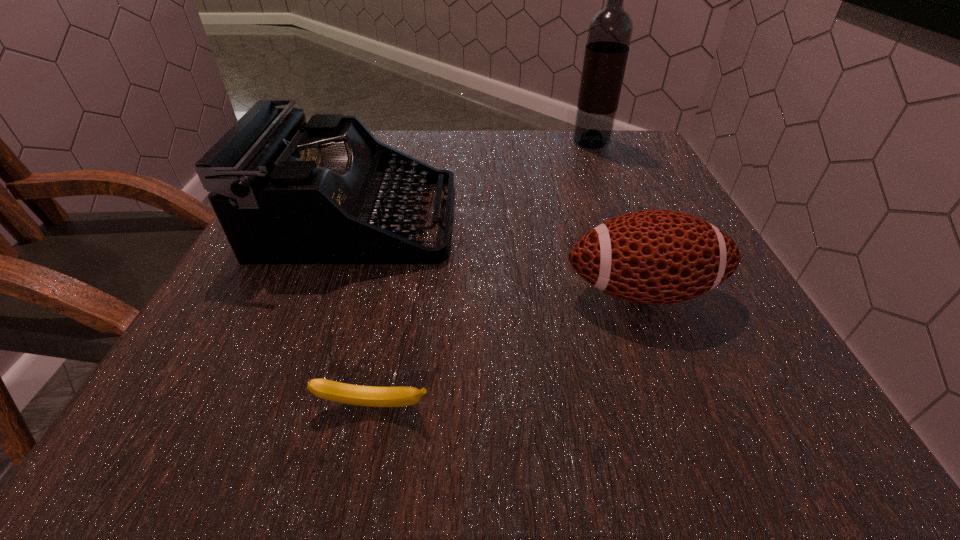
At what (x,y) coordinates should I click in order to perform the action: click on vacant space at the near left corner of the desktop. Please return your answer as a coordinate pair (x, y). Looking at the image, I should click on (283, 392).

Where is `vacant point at the far right corner`? This screenshot has width=960, height=540. vacant point at the far right corner is located at coordinates (662, 173).

Image resolution: width=960 pixels, height=540 pixels. In order to click on free region at the near right corner of the desktop in this screenshot , I will do `click(686, 398)`.

What are the coordinates of `vacant space that is in between the farthest object and the shortest object` in the screenshot? It's located at (482, 274).

What are the coordinates of `free area in between the wine bottle and the shortest object` in the screenshot? It's located at (482, 274).

Identify the location of empty location between the shortest object and the tallest object. The width and height of the screenshot is (960, 540). (482, 274).

I want to click on free space between the football and the third shortest object, so click(x=500, y=255).

You are a GUI agent. You are given a task and a screenshot of the screen. Output one action in this format:
    pyautogui.click(x=<x>, y=<y>)
    Task: Click on the blank region between the typewriter and the tallest object
    
    Given the screenshot: What is the action you would take?
    pyautogui.click(x=474, y=181)

Find the location of a particular element. vacant region between the farthest object and the nearest object is located at coordinates (482, 274).

You are a GUI agent. You are given a task and a screenshot of the screen. Output one action in this format:
    pyautogui.click(x=<x>, y=<y>)
    Task: Click on the free space between the third shortest object and the third tallest object
    This screenshot has width=960, height=540.
    Given the screenshot: What is the action you would take?
    pyautogui.click(x=500, y=255)